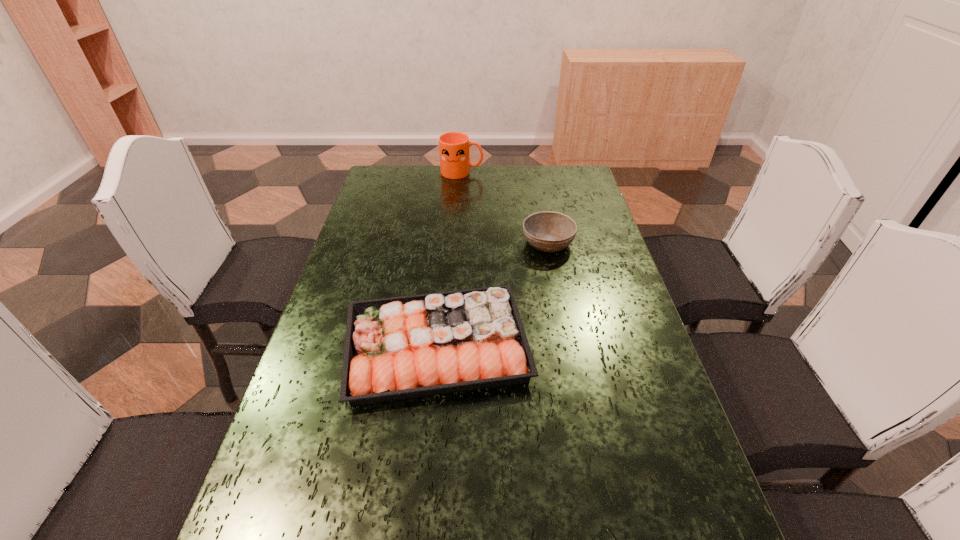
I want to click on the farthest object, so click(x=454, y=147).

Find the location of `mug`. mug is located at coordinates (454, 147).

Where is `bowl`? The height and width of the screenshot is (540, 960). bowl is located at coordinates (547, 231).

Find the location of a particular element. This screenshot has width=960, height=540. platter is located at coordinates (398, 348).

Identify the location of vacant space located 0.310m on the handle side of the farthest object. (562, 172).

In order to click on vacant region located 0.380m on the back of the second farthest object in this screenshot , I will do `click(535, 172)`.

The height and width of the screenshot is (540, 960). Identify the location of free space located on the right of the second nearest object. (623, 346).

What are the coordinates of `object that is at the far edge` in the screenshot? It's located at (454, 147).

This screenshot has height=540, width=960. I want to click on object at the left edge, so click(398, 348).

This screenshot has height=540, width=960. I want to click on object present at the right edge, so click(x=547, y=231).